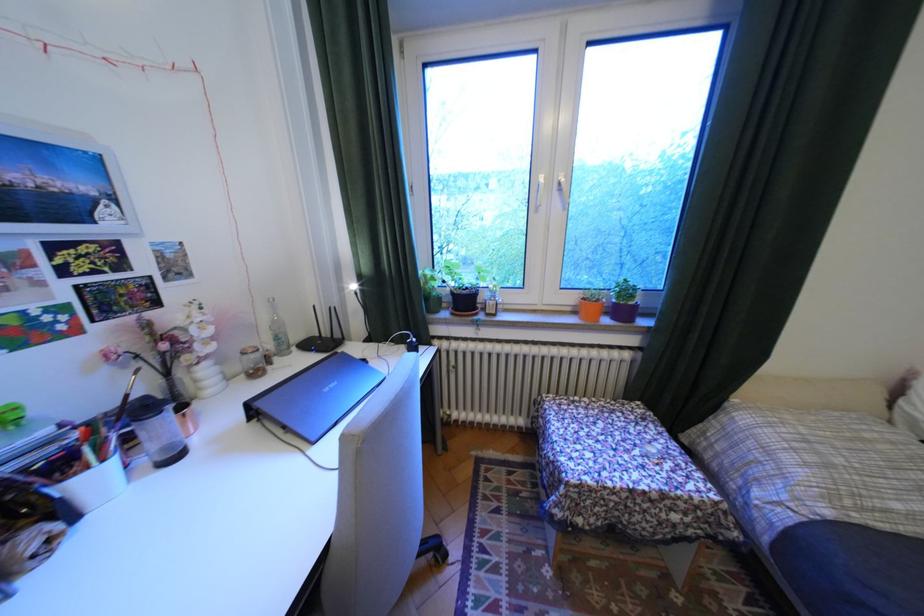
Identify the location of orange flower pot. click(x=590, y=305).